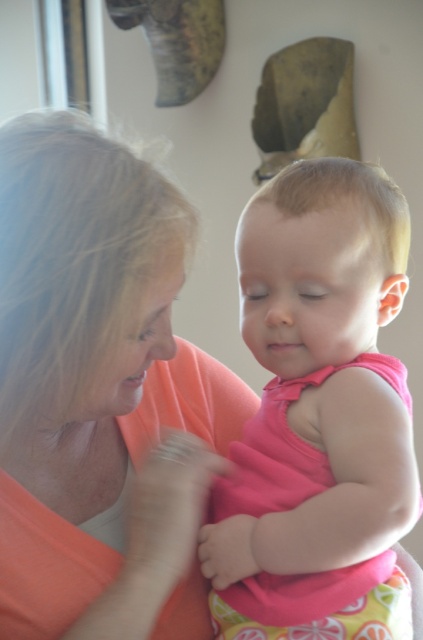
You are an artist analyzing this image. You want to place a golden star sticker exactly where the matte orange shirt at center is located. According to the coordinates provided, where should you place the sticker?

The matte orange shirt at center is located at coordinates point (99, 392), so you should place the golden star sticker at point (99, 392).

You are a photographer setting up a photo shoot and want to ensure the matte orange shirt at center and the pink fabric toddler at center are both visible. Based on their positions, which object is covering part of the other?

The matte orange shirt at center is positioned over the pink fabric toddler at center, so it is covering part of the toddler.

You are a photographer setting up for a family portrait. You notice the matte orange shirt at center and the pink fabric toddler at center in the frame. Which object is wider in the current composition?

The matte orange shirt at center is wider than the pink fabric toddler at center.